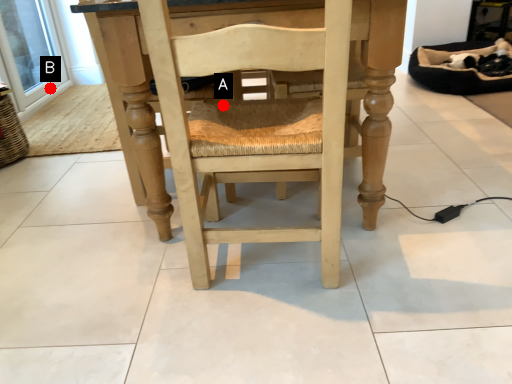
Question: Two points are circled on the image, labeled by A and B beside each circle. Which point is farther from the camera taking this photo?

Choices:
 (A) A is further
 (B) B is further

Answer: (B)